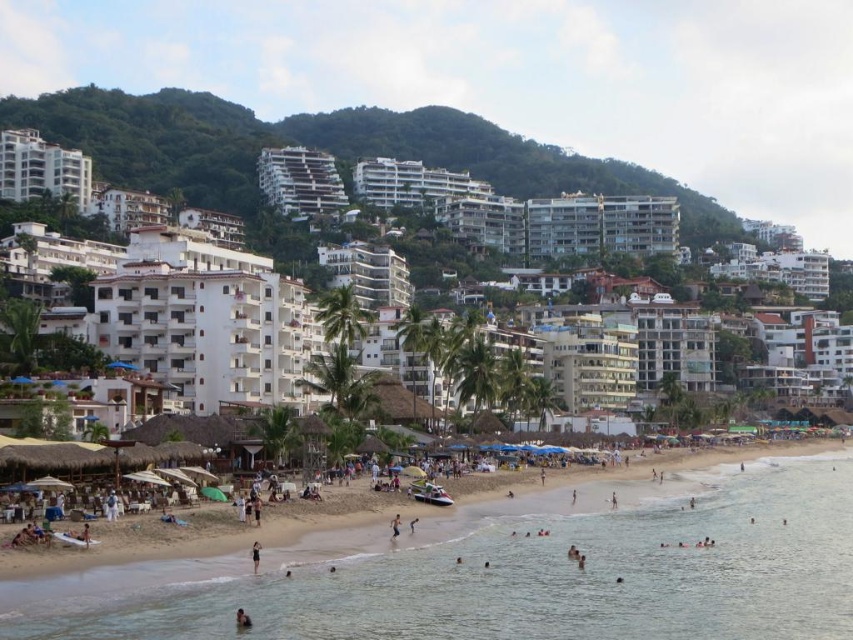
The width and height of the screenshot is (853, 640). What do you see at coordinates (42, 170) in the screenshot?
I see `white glossy building at upper left` at bounding box center [42, 170].

Locate an element on the screen. This screenshot has width=853, height=640. white glossy building at upper left is located at coordinates (42, 170).

Is point (361, 113) farther from viewer compared to point (15, 172)?

Yes, point (361, 113) is farther from viewer.

Locate an element on the screen. The image size is (853, 640). green leafy hillside at upper center is located at coordinates (326, 150).

Where is `green leafy hillside at upper center`? This screenshot has width=853, height=640. green leafy hillside at upper center is located at coordinates (326, 150).

Measure the distance from clear blue water at lower center to black matte swimsuit at lower center.

clear blue water at lower center and black matte swimsuit at lower center are 23.71 meters apart from each other.

Between clear blue water at lower center and black matte swimsuit at lower center, which one is positioned lower?

clear blue water at lower center

Is point (793, 499) positioned after point (254, 563)?

Yes, it is.

Identify the location of clear blue water at lower center. The image size is (853, 640). (511, 576).